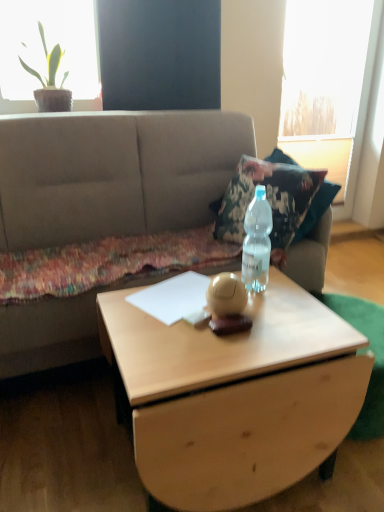
Find the location of `free spot above light wood coffee table at center (from a real-world perspective)`. free spot above light wood coffee table at center (from a real-world perspective) is located at coordinates (200, 323).